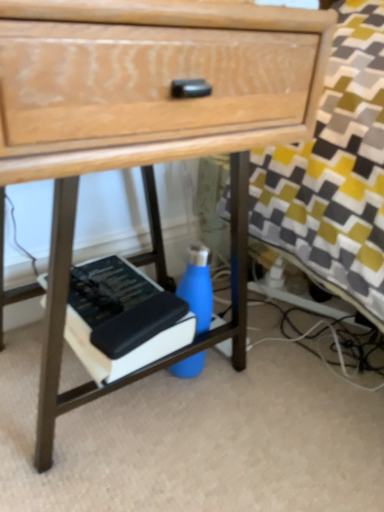
Find the location of a particular element. This screenshot has width=384, height=512. free location to the right of blue matte water bottle at center is located at coordinates (279, 375).